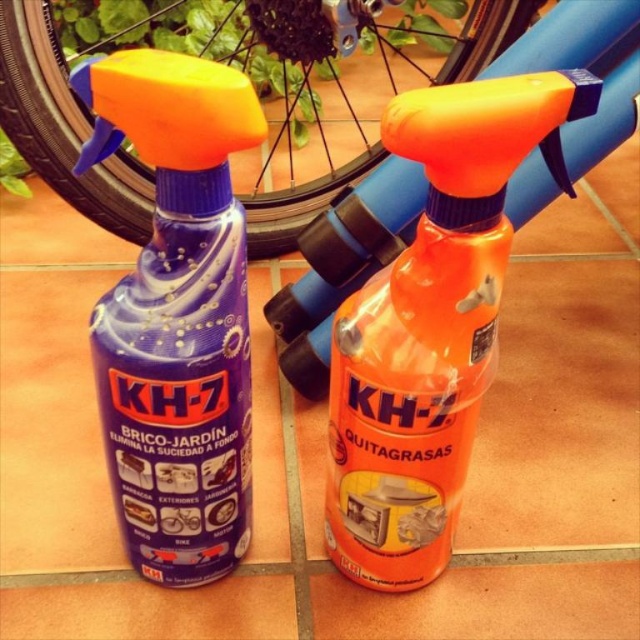
Question: Is matte plastic spray bottle at left further to the viewer compared to orange matte spray bottle at center?

Choices:
 (A) no
 (B) yes

Answer: (A)

Question: Considering the real-world distances, which object is farthest from the orange matte spray bottle at center?

Choices:
 (A) black rubber tire at upper center
 (B) matte plastic spray bottle at left

Answer: (A)

Question: Which object appears farthest from the camera in this image?

Choices:
 (A) matte plastic spray bottle at left
 (B) orange matte spray bottle at center

Answer: (B)

Question: Is the position of matte plastic spray bottle at left less distant than that of orange matte spray bottle at center?

Choices:
 (A) yes
 (B) no

Answer: (A)

Question: Among these objects, which one is nearest to the camera?

Choices:
 (A) black rubber tire at upper center
 (B) orange matte spray bottle at center

Answer: (B)

Question: Can you confirm if orange matte spray bottle at center is bigger than black rubber tire at upper center?

Choices:
 (A) no
 (B) yes

Answer: (A)